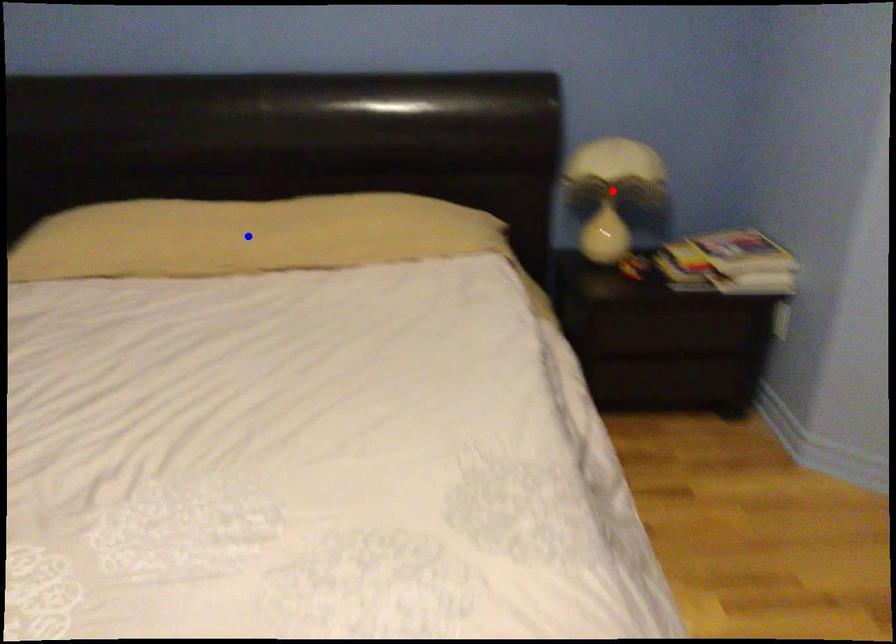
Question: Which of the two points in the image is closer to the camera?

Choices:
 (A) Blue point is closer.
 (B) Red point is closer.

Answer: (A)